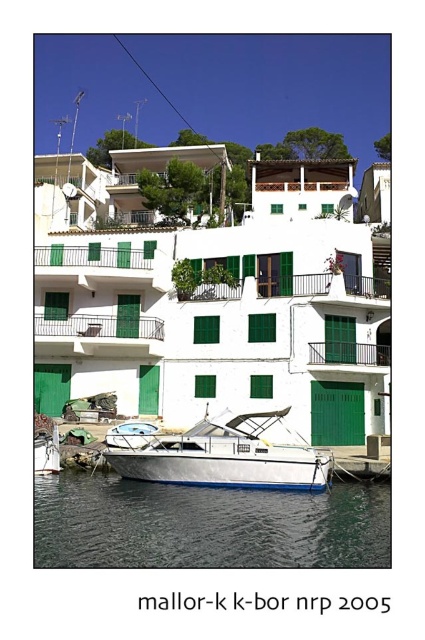
Question: Estimate the real-world distances between objects in this image. Which object is closer to the transparent blue water at lower center?

Choices:
 (A) white glossy boat at lower center
 (B) green metal balcony at center

Answer: (A)

Question: Can you confirm if transparent blue water at lower center is positioned above green metal balcony at center?

Choices:
 (A) yes
 (B) no

Answer: (B)

Question: Does transparent blue water at lower center appear over white glossy boat at lower center?

Choices:
 (A) yes
 (B) no

Answer: (B)

Question: Among these objects, which one is nearest to the camera?

Choices:
 (A) white glossy boat at lower center
 (B) green metal balcony at center
 (C) transparent blue water at lower center

Answer: (C)

Question: Can you confirm if transparent blue water at lower center is positioned below white glossy boat at lower center?

Choices:
 (A) yes
 (B) no

Answer: (A)

Question: Which object appears farthest from the camera in this image?

Choices:
 (A) white glossy boat at lower center
 (B) transparent blue water at lower center
 (C) green metal balcony at center

Answer: (C)